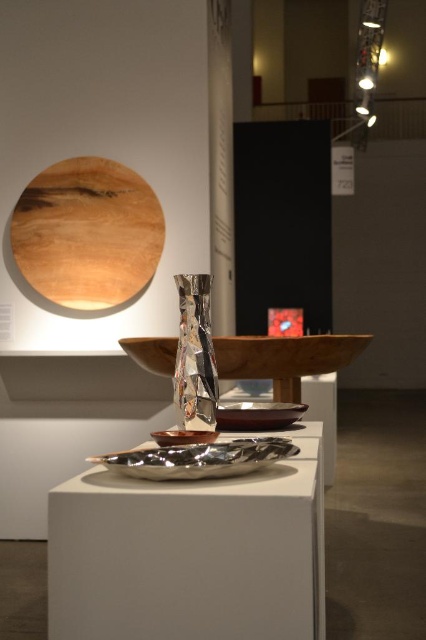
Question: Can you confirm if wooden circle at upper left is wider than silver reflective platter at center?

Choices:
 (A) no
 (B) yes

Answer: (B)

Question: Estimate the real-world distances between objects in this image. Which object is closer to the silver reflective platter at center?

Choices:
 (A) matte brown bowl at center
 (B) shiny metallic bowl at center
 (C) wooden platter at center
 (D) silver metallic tray at center

Answer: (D)

Question: Considering the real-world distances, which object is farthest from the wooden circle at upper left?

Choices:
 (A) matte brown bowl at center
 (B) shiny metallic bowl at center
 (C) silver metallic tray at center

Answer: (C)

Question: Considering the relative positions of silver metallic tray at center and shiny metallic bowl at center in the image provided, where is silver metallic tray at center located with respect to shiny metallic bowl at center?

Choices:
 (A) below
 (B) above

Answer: (A)

Question: Is silver metallic tray at center thinner than matte brown bowl at center?

Choices:
 (A) yes
 (B) no

Answer: (B)

Question: Which point appears farthest from the camera in this image?

Choices:
 (A) (253, 417)
 (B) (115, 468)

Answer: (A)